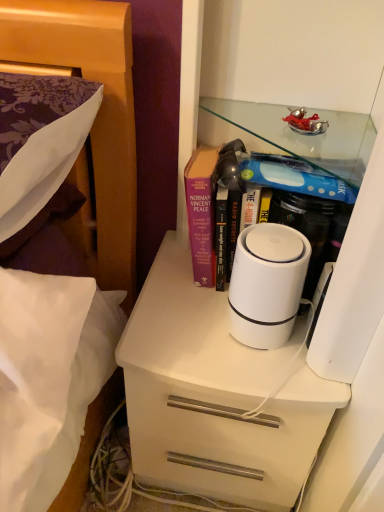
Find the location of a particular element. The width and height of the screenshot is (384, 512). vacant point above white matte chest of drawers at center (from a real-world perspective) is located at coordinates (210, 318).